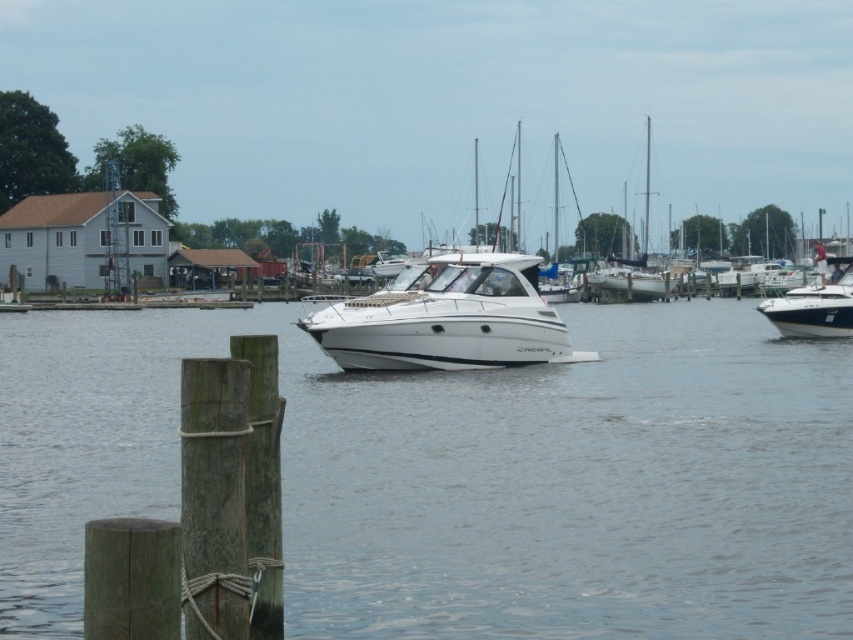
You are a boat operator who needs to navigate between the white glossy boat at center and the white glossy boat at right. Given that your boat requires a minimum of 30 feet of space to maneuver safely, can you safely navigate between them?

The white glossy boat at center is 36.97 feet from the white glossy boat at right. Since the required minimum space is 30 feet, the distance is sufficient for safe navigation between the white glossy boat at center and the white glossy boat at right.

Looking at this image, you are standing at the center of the marina and see two points marked in the image. The first point is at coordinates point (x=486, y=292) and the second is at point (x=769, y=312). Which point is closer to you?

Point (x=486, y=292) is in front of point (x=769, y=312), so it is closer to you.

You are a boat operator who needs to navigate a 30 feet long vessel through the marina. You see the clear water at center and the white glossy boat at right. Is there enough space between them to safely maneuver your vessel without collision?

The distance between the clear water at center and the white glossy boat at right is 44.17 feet. Since your vessel is 30 feet long, there is sufficient space to maneuver safely as 44.17 feet is greater than 30 feet.